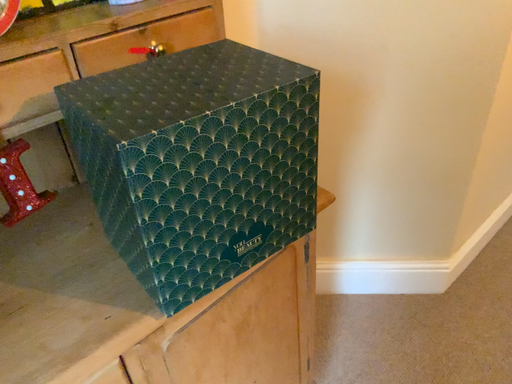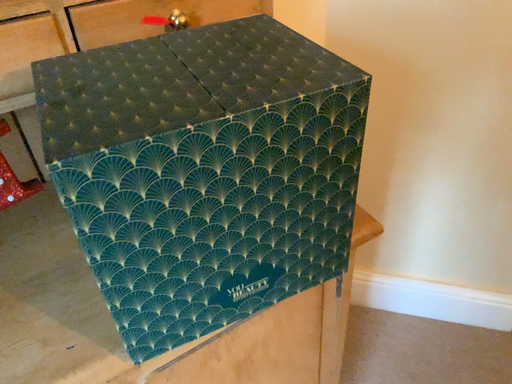
Question: How did the camera likely rotate when shooting the video?

Choices:
 (A) rotated right
 (B) rotated left

Answer: (B)